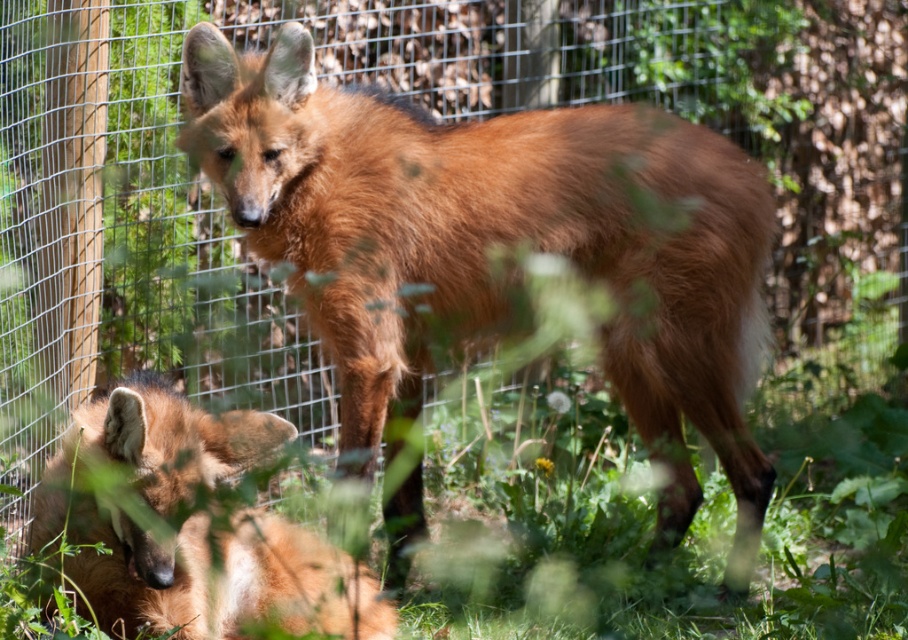
You are a zookeeper who needs to separate two foxes in the enclosure. The minimum distance required between them for safety is 36 inches. Given the current distance between the brown furry fox at center and the brown fur fox at lower left, can you safely leave them as they are?

The brown furry fox at center and the brown fur fox at lower left are 33.90 inches apart. Since the required minimum distance for safety is 36 inches, the current distance is insufficient. Therefore, they cannot be left as they are and need to be separated to meet the safety requirement.

You are a zookeeper observing two foxes in the enclosure. You notice the brown furry fox at center and the brown fur fox at lower left. Which fox is taller?

The brown furry fox at center is taller than the brown fur fox at lower left.

You are a zookeeper who needs to ensure each fox has enough space in their enclosure. The enclosure has a feeding station at the center. If both brown furry fox at center and brown fur fox at lower left want to approach the feeding station, which fox might have an easier time navigating around the other?

The brown fur fox at lower left might have an easier time navigating around the brown furry fox at center since it is smaller in size, allowing it to maneuver more easily around the larger fox.